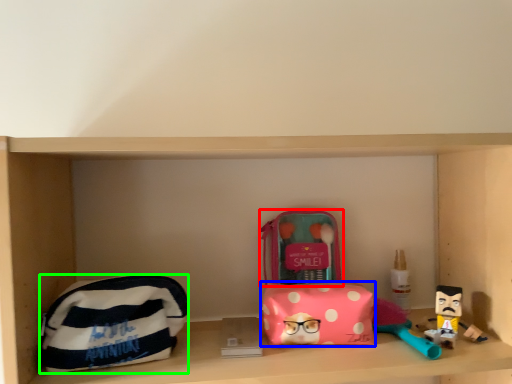
Question: Which is farther away from kit (highlighted by a red box)? pouch (highlighted by a blue box) or pouch (highlighted by a green box)?

Choices:
 (A) pouch
 (B) pouch

Answer: (B)